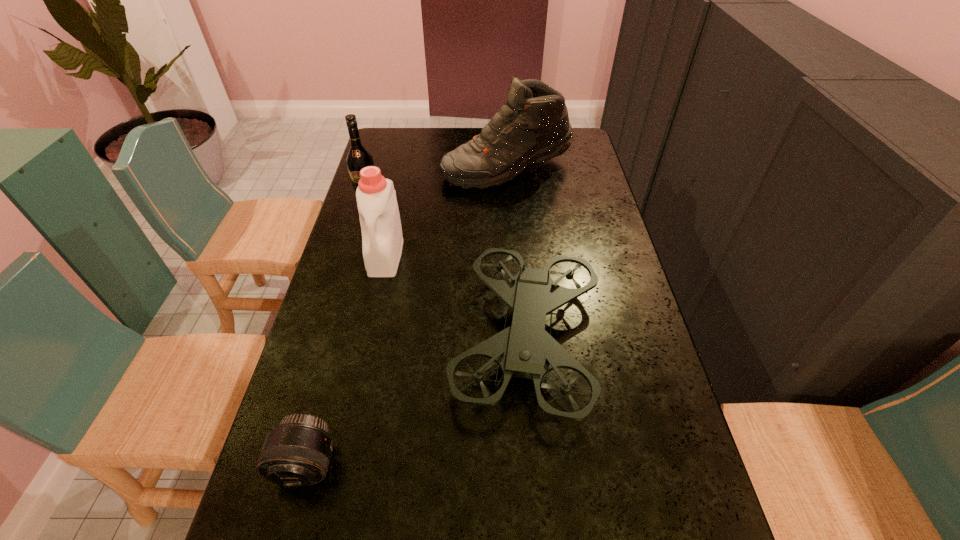
Identify which object is located as the third nearest to the fourth tallest object. Please provide its 2D coordinates. Your answer should be formatted as a tuple, i.e. [(x, y)], where the tuple contains the x and y coordinates of a point satisfying the conditions above.

[(532, 127)]

This screenshot has width=960, height=540. I want to click on free space that satisfies the following two spatial constraints: 1. on the label of the drone; 2. on the right side of the wine bottle, so click(326, 339).

Identify the location of free point that satisfies the following two spatial constraints: 1. on the front side of the drone; 2. on the right side of the farthest object. (521, 339).

Identify the location of free region that satisfies the following two spatial constraints: 1. on the label of the wine bottle; 2. on the left side of the fourth tallest object. (326, 339).